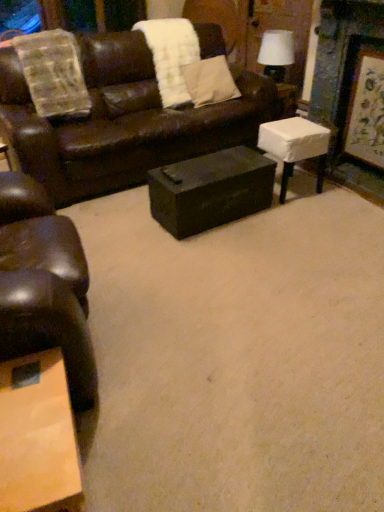
Find the location of `vacant space in front of matte black trunk at center, positioned as the 1th table in left-to-right order`. vacant space in front of matte black trunk at center, positioned as the 1th table in left-to-right order is located at coordinates (217, 262).